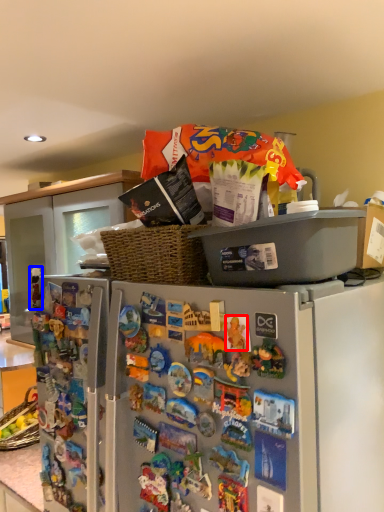
Question: Which object appears farthest to the camera in this image, toy (highlighted by a red box) or toy (highlighted by a blue box)?

Choices:
 (A) toy
 (B) toy

Answer: (B)